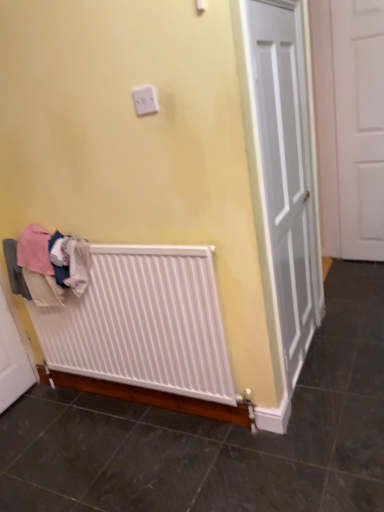
The height and width of the screenshot is (512, 384). Find the location of `white cotton clothes at lower left`. white cotton clothes at lower left is located at coordinates (47, 265).

Based on the photo, does white matte radiator at lower left have a greater height compared to white plastic outlet at upper center?

Indeed, white matte radiator at lower left has a greater height compared to white plastic outlet at upper center.

How many degrees apart are the facing directions of white matte radiator at lower left and white plastic outlet at upper center?

The angle between the facing direction of white matte radiator at lower left and the facing direction of white plastic outlet at upper center is 1.81 degrees.

Considering the points (187, 352) and (147, 91), which point is in front, point (187, 352) or point (147, 91)?

The point (147, 91) is in front.

Which object is further away from the camera, white matte radiator at lower left or white plastic outlet at upper center?

Positioned behind is white matte radiator at lower left.

From a real-world perspective, is white matte door at right positioned over white plastic outlet at upper center based on gravity?

No.

Is white matte door at right positioned beyond the bounds of white plastic outlet at upper center?

Yes.

Is white matte door at right directly adjacent to white plastic outlet at upper center?

No, white matte door at right is not beside white plastic outlet at upper center.

Is white matte door at right oriented away from white plastic outlet at upper center?

white matte door at right does not have its back to white plastic outlet at upper center.

Which is behind, point (97, 249) or point (370, 33)?

The point (370, 33) is farther from the camera.

From the picture: From a real-world perspective, is white matte radiator at lower left on white matte door at right?

No, from a real-world perspective, white matte radiator at lower left is not above white matte door at right.

Is white matte radiator at lower left placed right next to white matte door at right?

white matte radiator at lower left is not next to white matte door at right, and they're not touching.

Is white matte radiator at lower left spatially inside white matte door at right, or outside of it?

white matte radiator at lower left is spatially situated outside white matte door at right.

Between white plastic outlet at upper center and white cotton clothes at lower left, which one appears on the right side from the viewer's perspective?

From the viewer's perspective, white plastic outlet at upper center appears more on the right side.

Between white plastic outlet at upper center and white cotton clothes at lower left, which one has less height?

With less height is white plastic outlet at upper center.

I want to click on clothing that appears below the white plastic outlet at upper center (from the image's perspective), so click(x=47, y=265).

Consider the image. Which is further, (137,98) or (21,284)?

Point (21,284)

Is white plastic outlet at upper center not inside white matte door at right?

Yes, white plastic outlet at upper center is outside of white matte door at right.

Can you tell me how much white plastic outlet at upper center and white matte door at right differ in facing direction?

The angular difference between white plastic outlet at upper center and white matte door at right is 10.1 degrees.

Is white plastic outlet at upper center oriented away from white matte door at right?

Yes, white plastic outlet at upper center's orientation is away from white matte door at right.

Is point (148, 92) positioned before point (351, 16)?

Yes, it is in front of point (351, 16).

From a real-world perspective, between white matte door at right and white cotton clothes at lower left, who is vertically lower?

From a 3D spatial view, white cotton clothes at lower left is below.

Where is `door on the right of white cotton clothes at lower left`? door on the right of white cotton clothes at lower left is located at coordinates (359, 125).

From the image's perspective, which one is positioned higher, white matte door at right or white cotton clothes at lower left?

white matte door at right, from the image's perspective.

Between white matte door at right and white cotton clothes at lower left, which one has smaller width?

white cotton clothes at lower left is thinner.

From the image's perspective, is white plastic outlet at upper center on white matte radiator at lower left?

Yes, from the image's perspective, white plastic outlet at upper center is over white matte radiator at lower left.

Does white plastic outlet at upper center turn towards white matte radiator at lower left?

No.

Can you tell me how much white plastic outlet at upper center and white matte radiator at lower left differ in facing direction?

They differ by 1.81 degrees in their facing directions.

From a real-world perspective, is white plastic outlet at upper center on top of white matte radiator at lower left?

Indeed, from a real-world perspective, white plastic outlet at upper center stands above white matte radiator at lower left.

The width and height of the screenshot is (384, 512). I want to click on radiator behind the white plastic outlet at upper center, so click(x=143, y=322).

I want to click on electric outlet on the left of white matte door at right, so click(145, 99).

When comparing their distances from white plastic outlet at upper center, does white matte door at right or white cotton clothes at lower left seem further?

white matte door at right is positioned further to the anchor white plastic outlet at upper center.

Considering their positions, is white cotton clothes at lower left positioned closer to white plastic outlet at upper center than white matte door at right?

white cotton clothes at lower left.

Looking at this image, based on their spatial positions, is white plastic outlet at upper center or white cotton clothes at lower left further from white matte door at right?

white cotton clothes at lower left lies further to white matte door at right than the other object.

When comparing their distances from white cotton clothes at lower left, does white matte radiator at lower left or white plastic outlet at upper center seem closer?

Among the two, white matte radiator at lower left is located nearer to white cotton clothes at lower left.

Based on their spatial positions, is white matte radiator at lower left or white cotton clothes at lower left further from white matte door at right?

white cotton clothes at lower left lies further to white matte door at right than the other object.

Estimate the real-world distances between objects in this image. Which object is closer to white matte radiator at lower left, white matte door at right or white plastic outlet at upper center?

Among the two, white plastic outlet at upper center is located nearer to white matte radiator at lower left.

Estimate the real-world distances between objects in this image. Which object is closer to white matte radiator at lower left, white plastic outlet at upper center or white cotton clothes at lower left?

The object closer to white matte radiator at lower left is white cotton clothes at lower left.

When comparing their distances from white cotton clothes at lower left, does white plastic outlet at upper center or white matte radiator at lower left seem further?

white plastic outlet at upper center is further to white cotton clothes at lower left.

You are a GUI agent. You are given a task and a screenshot of the screen. Output one action in this format:
    pyautogui.click(x=<x>, y=<y>)
    Task: Click on the electric outlet between white matte radiator at lower left and white matte door at right from left to right
    The image size is (384, 512).
    Given the screenshot: What is the action you would take?
    pyautogui.click(x=145, y=99)

Find the location of `radiator situated between white cotton clothes at lower left and white matte door at right from left to right`. radiator situated between white cotton clothes at lower left and white matte door at right from left to right is located at coordinates (143, 322).

Where is `electric outlet situated between white cotton clothes at lower left and white matte door at right from left to right`? This screenshot has height=512, width=384. electric outlet situated between white cotton clothes at lower left and white matte door at right from left to right is located at coordinates click(145, 99).

Where is `clothing that lies between white plastic outlet at upper center and white matte radiator at lower left from top to bottom`? This screenshot has height=512, width=384. clothing that lies between white plastic outlet at upper center and white matte radiator at lower left from top to bottom is located at coordinates (47, 265).